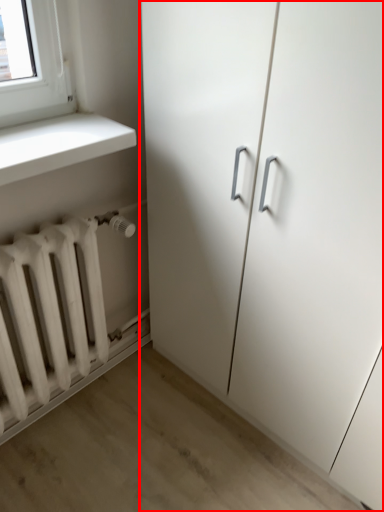
Question: From the image's perspective, considering the relative positions of cupboard (annotated by the red box) and radiator in the image provided, where is cupboard (annotated by the red box) located with respect to the staircase?

Choices:
 (A) below
 (B) above

Answer: (B)